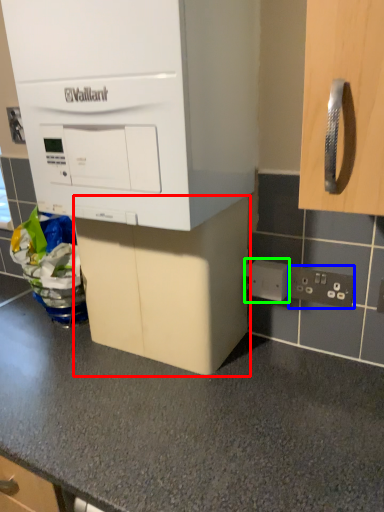
Question: Based on their relative distances, which object is nearer to cabinetry (highlighted by a red box)? Choose from electric outlet (highlighted by a blue box) and electric outlet (highlighted by a green box).

Choices:
 (A) electric outlet
 (B) electric outlet

Answer: (B)